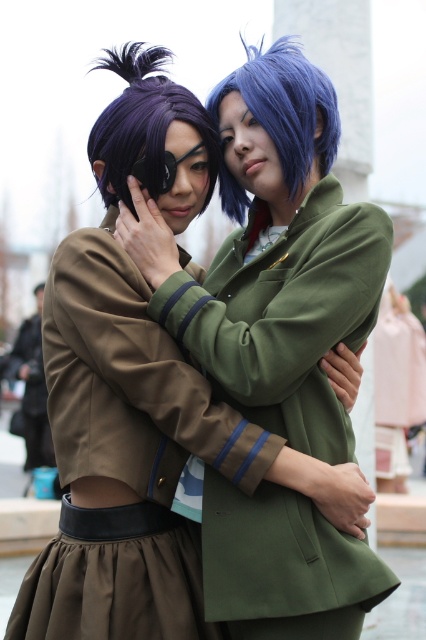
Question: Considering the real-world distances, which object is closest to the matte brown dress at center?

Choices:
 (A) purple matte wig at upper left
 (B) blue matte wig at upper center

Answer: (B)

Question: Observing the image, what is the correct spatial positioning of matte brown dress at center in reference to purple matte wig at upper left?

Choices:
 (A) right
 (B) left

Answer: (A)

Question: Considering the real-world distances, which object is closest to the purple matte wig at upper left?

Choices:
 (A) blue matte wig at upper center
 (B) matte brown dress at center

Answer: (A)

Question: Which object is positioned farthest from the blue matte wig at upper center?

Choices:
 (A) purple matte wig at upper left
 (B) matte brown dress at center

Answer: (B)

Question: Can you confirm if matte brown dress at center is positioned to the right of blue matte wig at upper center?

Choices:
 (A) yes
 (B) no

Answer: (B)

Question: Is blue matte wig at upper center bigger than purple matte wig at upper left?

Choices:
 (A) yes
 (B) no

Answer: (B)